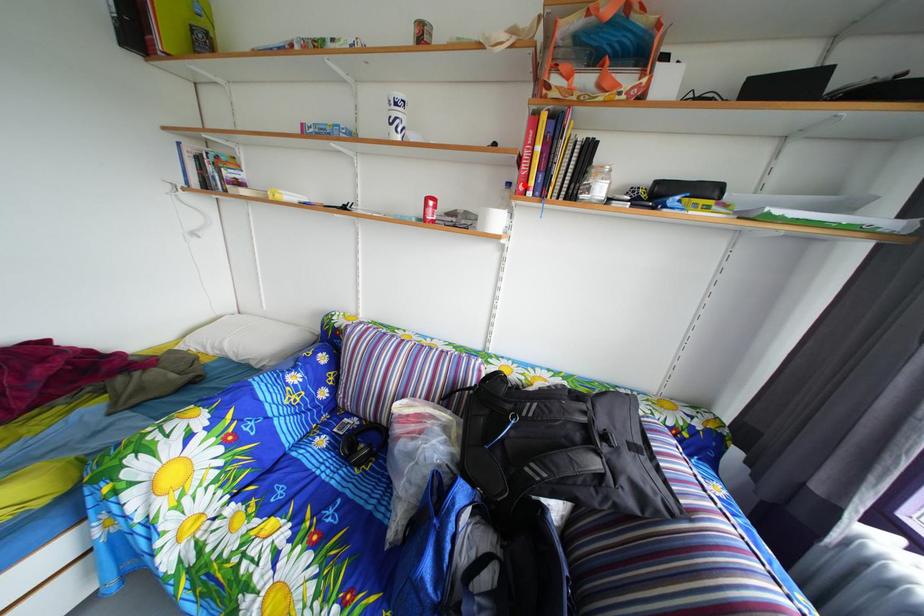
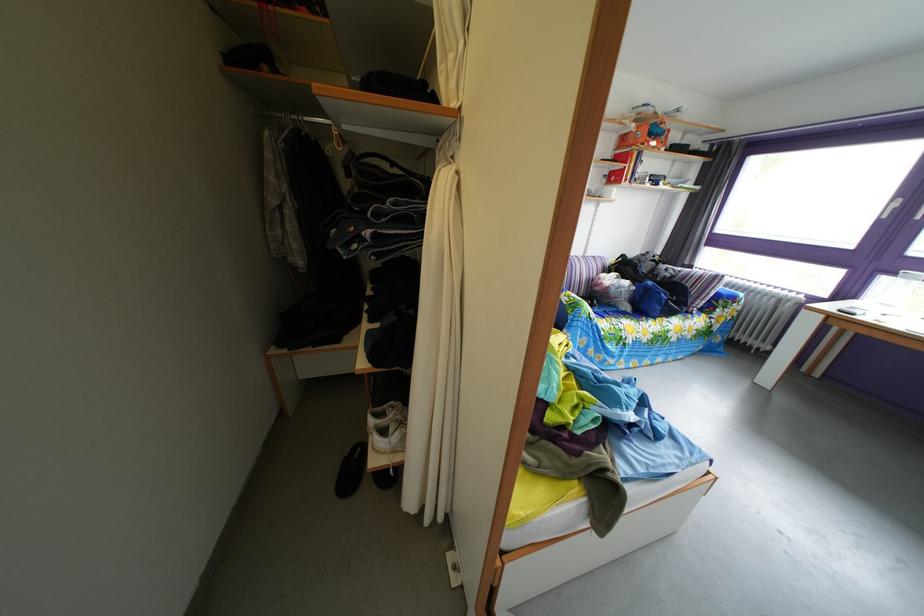
In the second image, find the point that corresponds to the highlighted location in the first image.

(618, 180)